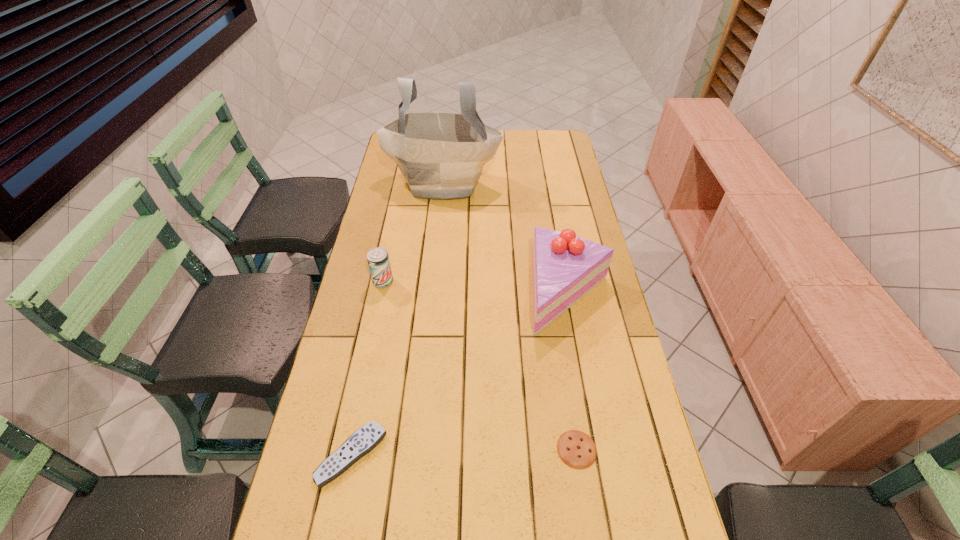
You are a GUI agent. You are given a task and a screenshot of the screen. Output one action in this format:
    pyautogui.click(x=<x>, y=<y>)
    Task: Click on the free spot between the tallest object and the cake
    
    Given the screenshot: What is the action you would take?
    pyautogui.click(x=506, y=238)

Locate an element on the screen. The height and width of the screenshot is (540, 960). empty location between the shopping bag and the beer can is located at coordinates (413, 232).

Locate an element on the screen. The width and height of the screenshot is (960, 540). free space between the shortest object and the fourth tallest object is located at coordinates (464, 452).

The width and height of the screenshot is (960, 540). Find the location of `vacant area that lies between the second tallest object and the beer can`. vacant area that lies between the second tallest object and the beer can is located at coordinates (476, 287).

At what (x,y) coordinates should I click in order to perform the action: click on vacant area that lies between the tallest object and the cookie. Please return your answer as a coordinate pair (x, y). This screenshot has height=540, width=960. Looking at the image, I should click on (510, 316).

Locate an element on the screen. Image resolution: width=960 pixels, height=540 pixels. vacant space that is in between the cookie and the cake is located at coordinates (573, 371).

In order to click on free space between the shopping bag and the cookie in this screenshot , I will do `click(510, 316)`.

You are a GUI agent. You are given a task and a screenshot of the screen. Output one action in this format:
    pyautogui.click(x=<x>, y=<y>)
    Task: Click on the empty space that is in between the remote control and the tallest object
    The height and width of the screenshot is (540, 960).
    Given the screenshot: What is the action you would take?
    pyautogui.click(x=397, y=319)

Identify the location of free space that is in between the beer can and the cookie. The height and width of the screenshot is (540, 960). (480, 366).

Point out which object is positioned as the nearest to the cookie. Please provide its 2D coordinates. Your answer should be formatted as a tuple, i.e. [(x, y)], where the tuple contains the x and y coordinates of a point satisfying the conditions above.

[(565, 267)]